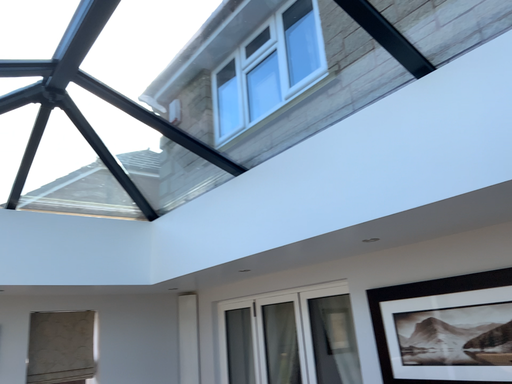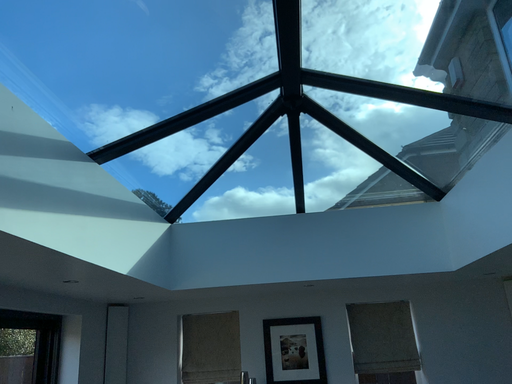
Question: How did the camera likely rotate when shooting the video?

Choices:
 (A) rotated right
 (B) rotated left

Answer: (B)